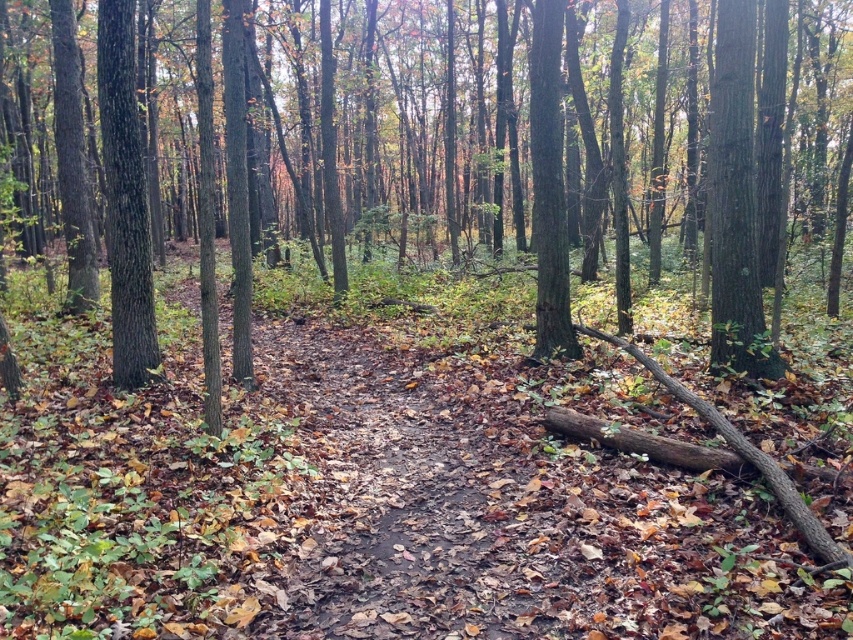
Question: Does brown rough tree at center come in front of smooth brown tree trunk at left?

Choices:
 (A) no
 (B) yes

Answer: (B)

Question: Where is brown rough tree at center located in relation to smooth brown tree trunk at left in the image?

Choices:
 (A) left
 (B) right

Answer: (B)

Question: Does brown rough tree at center appear over smooth brown tree trunk at left?

Choices:
 (A) yes
 (B) no

Answer: (A)

Question: Which point is farther to the camera?

Choices:
 (A) brown rough tree at center
 (B) smooth brown tree trunk at left

Answer: (B)